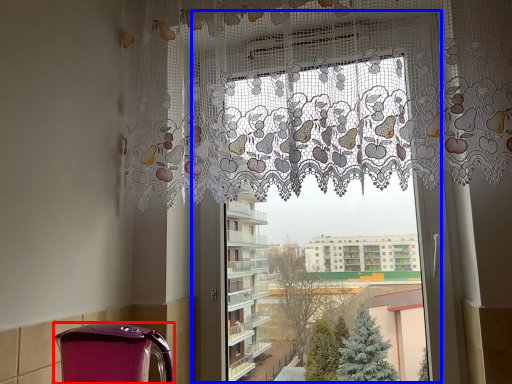
Question: Which object appears closest to the camera in this image, appliance (highlighted by a red box) or window frame (highlighted by a blue box)?

Choices:
 (A) appliance
 (B) window frame

Answer: (A)